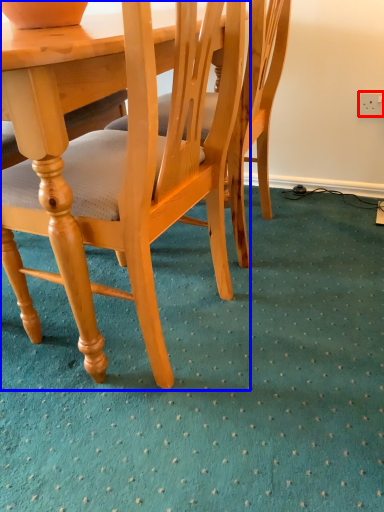
Question: Which object appears farthest to the camera in this image, power outlet (highlighted by a red box) or chair (highlighted by a blue box)?

Choices:
 (A) power outlet
 (B) chair

Answer: (A)